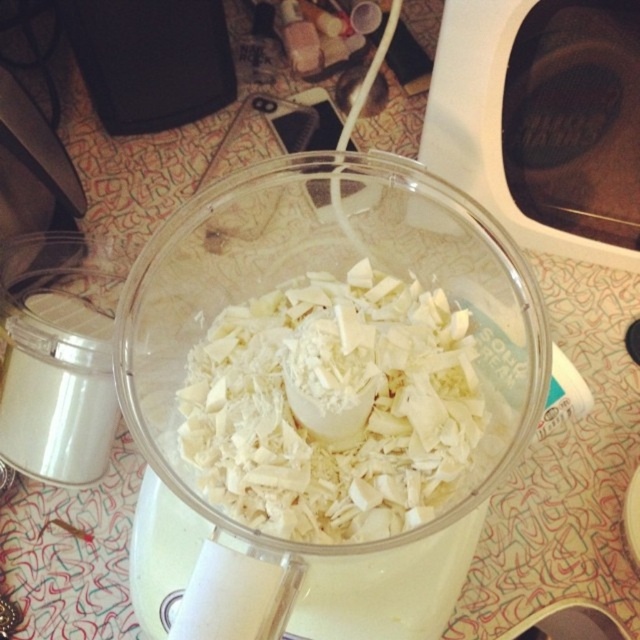
You are holding a spoon and want to reach the transparent plastic bowl at center to taste the contents. Considering your arm length is 24 inches, can you comfortably reach the bowl without moving your feet?

The transparent plastic bowl at center is 18.04 inches away from the camera, so yes, you can comfortably reach it with your 24 inch arm length.

You are organizing the kitchen counter and need to place the transparent plastic bowl at center and the white shredded coconut at center into a drawer. The drawer has a divider that separates it into two sections. Which object should go into the left section of the drawer?

The transparent plastic bowl at center should go into the left section of the drawer because it is positioned on the left side of the white shredded coconut at center in the image.

Consider the image. You are standing in the kitchen and want to reach the point marked as point [288,218]. The food processor is between you and that point. Can you safely step forward to reach it without bumping into the food processor?

The distance between point [288,218] and the viewer is 24.20 inches. Since the food processor is between you and the point, you need to ensure there is enough space to move forward. However, the exact distance from the food processor to the viewer isn not provided, so it is uncertain if stepping forward would cause a collision. Proceed with caution.